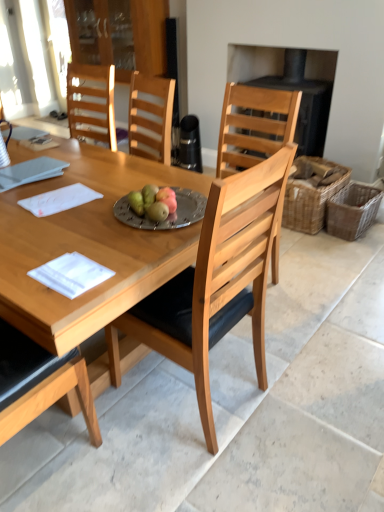
Identify the location of unoccupied area in front of light wood chair at center. This screenshot has height=512, width=384. (187, 471).